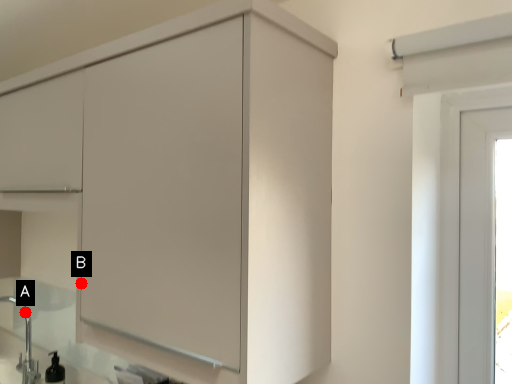
Question: Two points are circled on the image, labeled by A and B beside each circle. Which point is further to the camera?

Choices:
 (A) A is further
 (B) B is further

Answer: (A)